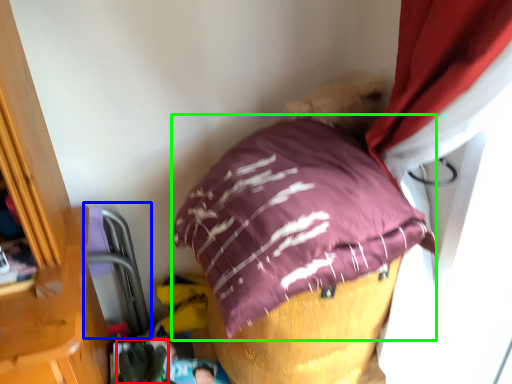
Question: Which object is the closest to the clothing (highlighted by a red box)? Choose among these: bean bag chair (highlighted by a blue box) or pillow (highlighted by a green box).

Choices:
 (A) bean bag chair
 (B) pillow

Answer: (A)